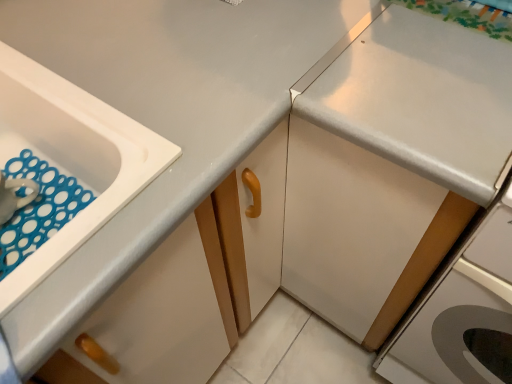
Image resolution: width=512 pixels, height=384 pixels. I want to click on empty space that is ontop of white glossy countertop at upper right, so click(x=444, y=58).